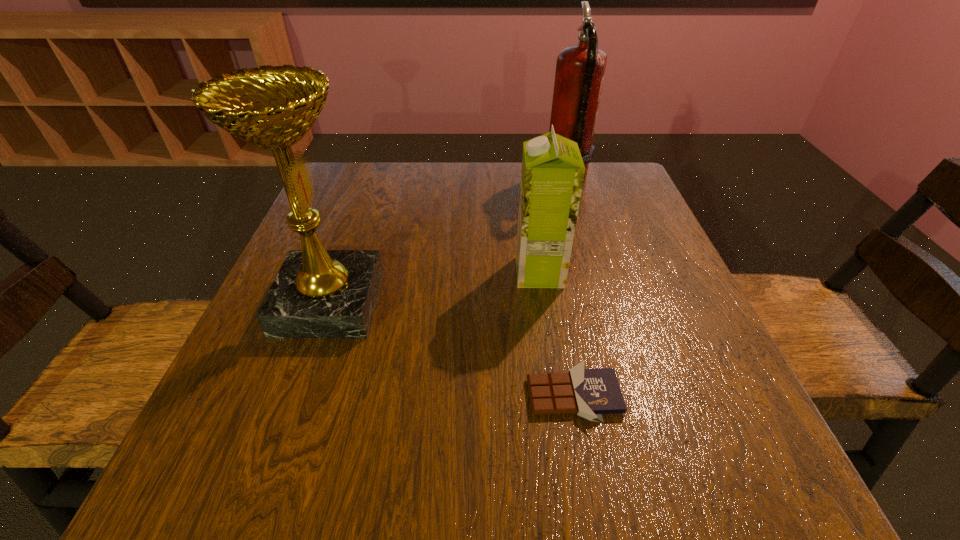
This screenshot has height=540, width=960. Identify the location of free location that satisfies the following two spatial constraints: 1. on the front-facing side of the leftmost object; 2. on the right side of the shortest object. (297, 395).

Identify the location of free space that satisfies the following two spatial constraints: 1. on the front-facing side of the nearest object; 2. on the left side of the leftmost object. (297, 395).

Where is `vacant point that satisfies the following two spatial constraints: 1. on the front side of the second shortest object; 2. on the front-facing side of the award`? Image resolution: width=960 pixels, height=540 pixels. vacant point that satisfies the following two spatial constraints: 1. on the front side of the second shortest object; 2. on the front-facing side of the award is located at coordinates (544, 302).